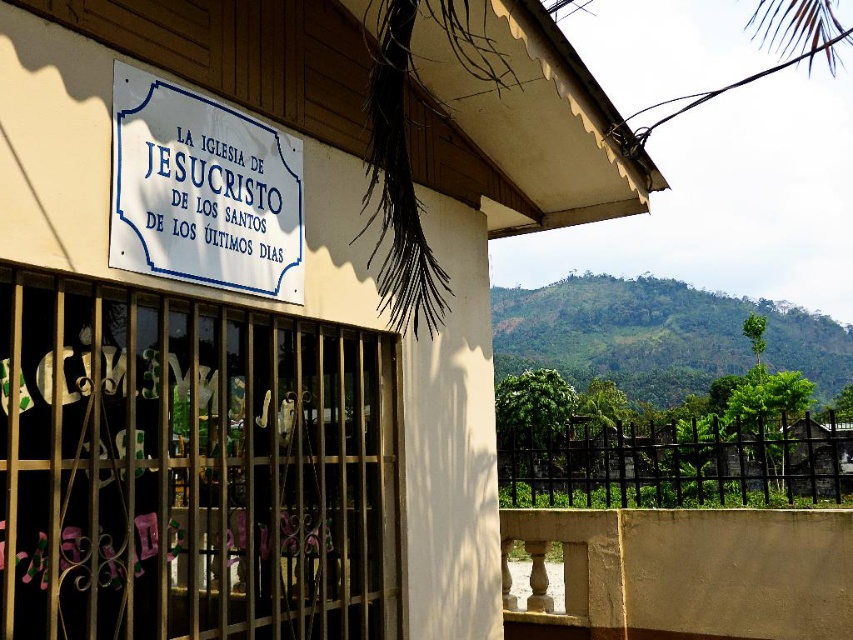
Does white matte sign at upper center have a greater width compared to black metal fence at lower right?

No.

This screenshot has height=640, width=853. I want to click on white matte sign at upper center, so click(190, 468).

Find the location of a particular element. white matte sign at upper center is located at coordinates (190, 468).

Does white paper sign at upper center appear on the right side of black metal fence at lower right?

In fact, white paper sign at upper center is to the left of black metal fence at lower right.

Is white paper sign at upper center closer to camera compared to black metal fence at lower right?

Yes, white paper sign at upper center is closer to the viewer.

Who is more distant from viewer, (136, 97) or (660, 481)?

The point (660, 481) is more distant.

Where is `white paper sign at upper center`? white paper sign at upper center is located at coordinates (202, 192).

Who is positioned more to the right, white matte sign at upper center or white paper sign at upper center?

white paper sign at upper center is more to the right.

Between white matte sign at upper center and white paper sign at upper center, which one appears on the left side from the viewer's perspective?

white matte sign at upper center

Describe the element at coordinates (190, 468) in the screenshot. I see `white matte sign at upper center` at that location.

Locate an element on the screen. The width and height of the screenshot is (853, 640). white matte sign at upper center is located at coordinates (190, 468).